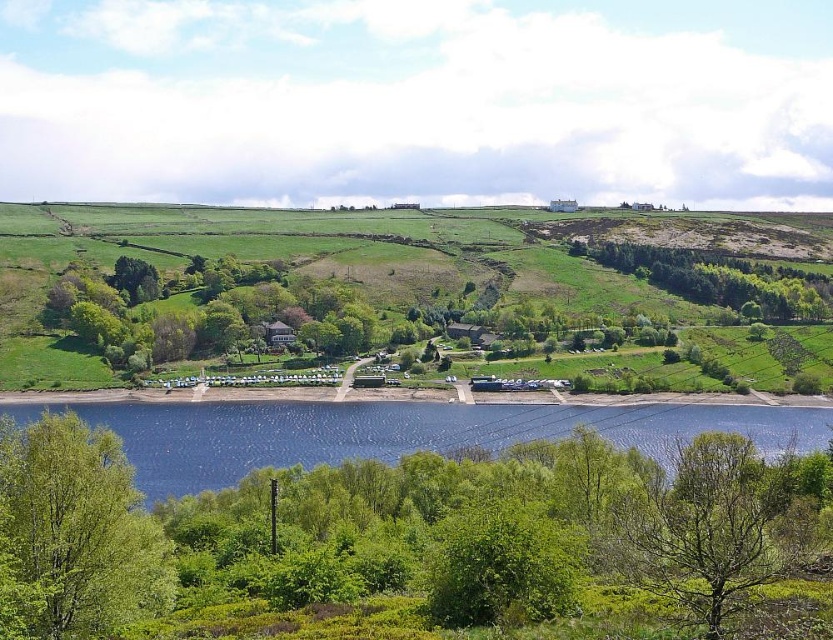
Is blue water at lower center positioned before green leafy tree at center?

Yes, it is.

The width and height of the screenshot is (833, 640). Describe the element at coordinates (402, 433) in the screenshot. I see `blue water at lower center` at that location.

This screenshot has width=833, height=640. I want to click on blue water at lower center, so click(402, 433).

What do you see at coordinates (78, 529) in the screenshot? I see `green leafy tree at lower left` at bounding box center [78, 529].

Who is more forward, (63, 548) or (797, 317)?

Point (63, 548) is more forward.

The height and width of the screenshot is (640, 833). What are the coordinates of `green leafy tree at lower left` in the screenshot? It's located at (78, 529).

Does blue water at lower center have a larger size compared to green leafy trees at right?

Yes, blue water at lower center is bigger than green leafy trees at right.

Identify the location of blue water at lower center. (402, 433).

You are a GUI agent. You are given a task and a screenshot of the screen. Output one action in this format:
    pyautogui.click(x=<x>, y=<y>)
    Task: Click on the blue water at lower center
    The width and height of the screenshot is (833, 640).
    Given the screenshot: What is the action you would take?
    pyautogui.click(x=402, y=433)